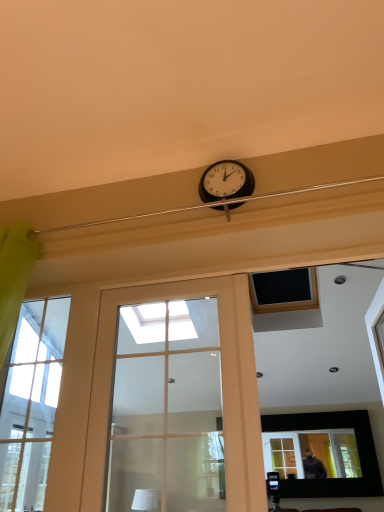
Question: Considering the positions of white matte lampshade at upper center and black plastic clock at upper center in the image, is white matte lampshade at upper center wider or thinner than black plastic clock at upper center?

Choices:
 (A) thin
 (B) wide

Answer: (B)

Question: Looking at the image, does white matte lampshade at upper center seem bigger or smaller compared to black plastic clock at upper center?

Choices:
 (A) big
 (B) small

Answer: (A)

Question: Which object is positioned closest to the matte glass door at center?

Choices:
 (A) clear glass window at left
 (B) matte black picture frame at upper center
 (C) black plastic clock at upper center
 (D) white matte lampshade at upper center

Answer: (D)

Question: Which object is the farthest from the black plastic clock at upper center?

Choices:
 (A) matte glass door at center
 (B) white matte lampshade at upper center
 (C) clear glass window at left
 (D) matte black picture frame at upper center

Answer: (D)